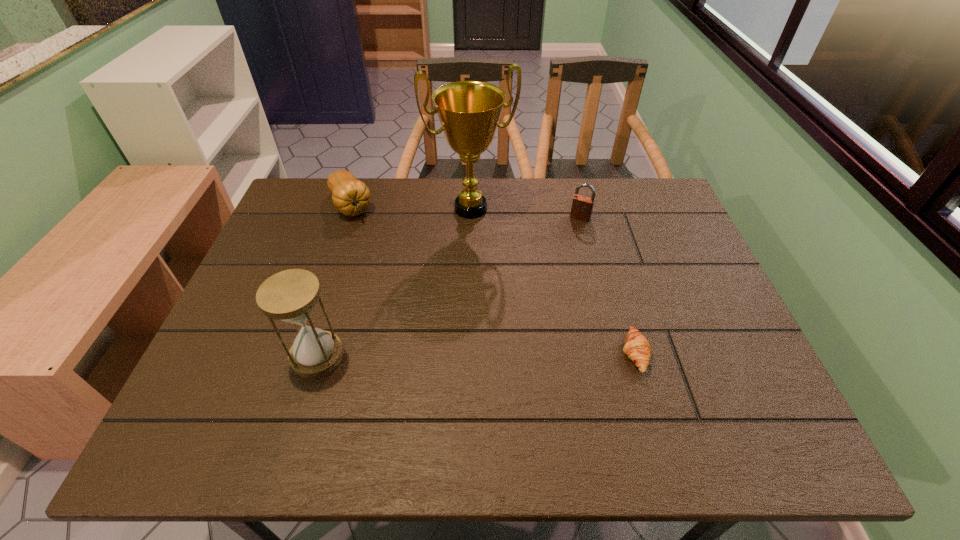
The image size is (960, 540). Find the location of `free space on the desktop that is between the hourglass and the pastry and is positioned on the front-facing side of the padlock`. free space on the desktop that is between the hourglass and the pastry and is positioned on the front-facing side of the padlock is located at coordinates (515, 354).

Identify the location of vacant space on the desktop that is between the hourglass and the shortest object and is positioned on the stem side of the gourd. The width and height of the screenshot is (960, 540). (441, 355).

What are the coordinates of `free spot on the desktop that is between the hourglass and the shortest object and is positioned on the front view with handles of the tallest object` in the screenshot? It's located at (516, 354).